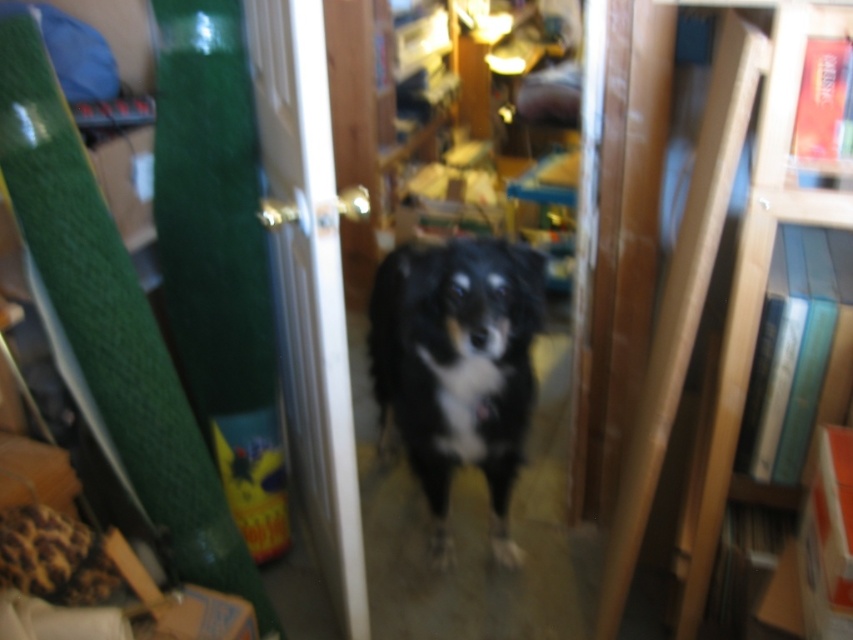
Question: Which of the following is the farthest from the observer?

Choices:
 (A) wooden bookcase at right
 (B) black fur dog at center

Answer: (B)

Question: Is wooden bookcase at right smaller than black fur dog at center?

Choices:
 (A) yes
 (B) no

Answer: (A)

Question: Is wooden bookcase at right smaller than black fur dog at center?

Choices:
 (A) yes
 (B) no

Answer: (A)

Question: Which object is closer to the camera taking this photo?

Choices:
 (A) wooden bookcase at right
 (B) black fur dog at center

Answer: (A)

Question: Is wooden bookcase at right closer to the viewer compared to black fur dog at center?

Choices:
 (A) no
 (B) yes

Answer: (B)